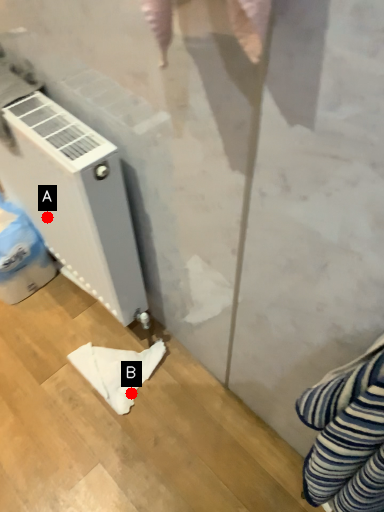
Question: Two points are circled on the image, labeled by A and B beside each circle. Which point appears closest to the camera in this image?

Choices:
 (A) A is closer
 (B) B is closer

Answer: (A)